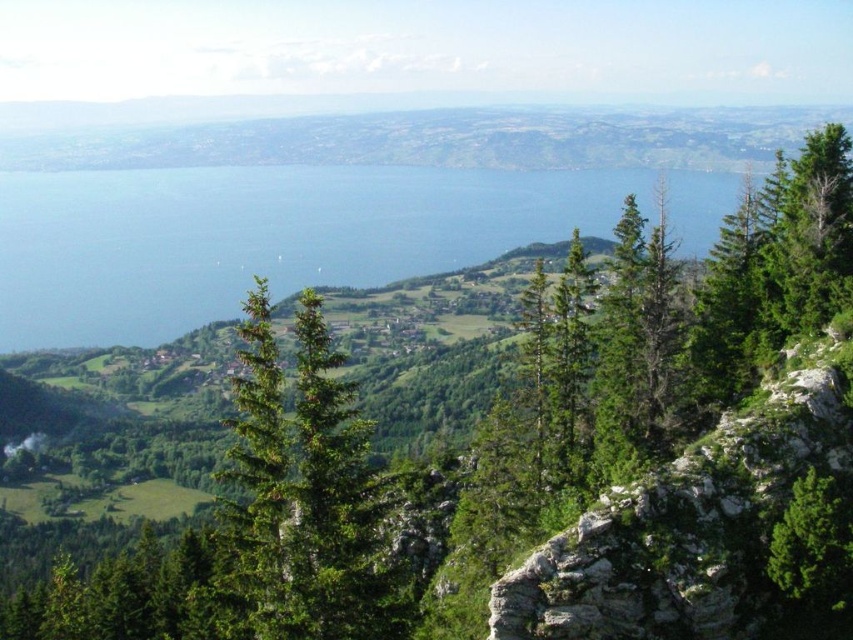
You are planning to take a photo of the blue water at center and the green textured tree at right. Which object should you focus on first if you want to capture both in a single frame without moving the camera?

The blue water at center is larger in size than the green textured tree at right, so you should focus on the blue water at center first to ensure it fills the frame appropriately before adjusting for the smaller tree.

You are standing at the vantage point and want to determine which of the two points, point (206, 216) or point (822, 602), is closer to you. Based on the scene description, which point is nearer?

Point (206, 216) is further to the viewer than point (822, 602). Wait, no, the description says the opposite. Let me check again. The Objects Description states that point (206, 216) is further to the viewer than point (822, 602). Hmm, so the answer should be that point (206, 216) is closer? Wait, no. If point A is further to the viewer than point B, that means point A is closer to the viewer, right? Because being further to the viewer implies it is nearer. Wait, maybe I got confused. Let me think